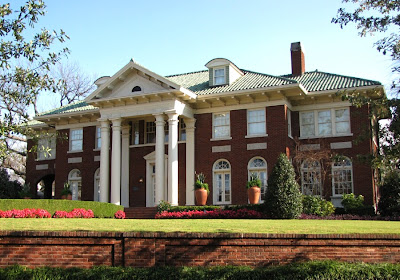
At what (x,y) coordinates should I click in order to perform the action: click on 4 white columns. Please return your answer as a coordinate pair (x, y). The width and height of the screenshot is (400, 280). Looking at the image, I should click on (112, 198), (107, 190), (173, 128), (159, 153).